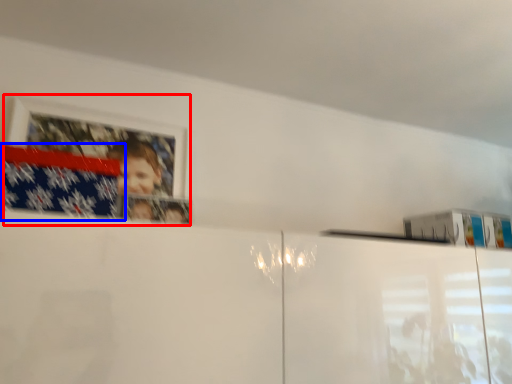
Question: Which point is further to the camera, picture frame (highlighted by a red box) or flag (highlighted by a blue box)?

Choices:
 (A) picture frame
 (B) flag

Answer: (A)